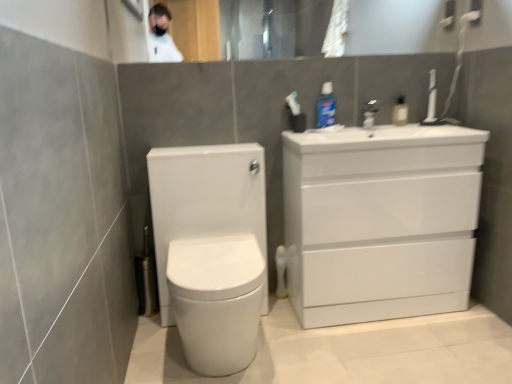
Where is `spots to the right of blue glossy mouthwash at upper center, which is the second toiletry from right to left`? The image size is (512, 384). spots to the right of blue glossy mouthwash at upper center, which is the second toiletry from right to left is located at coordinates tap(358, 125).